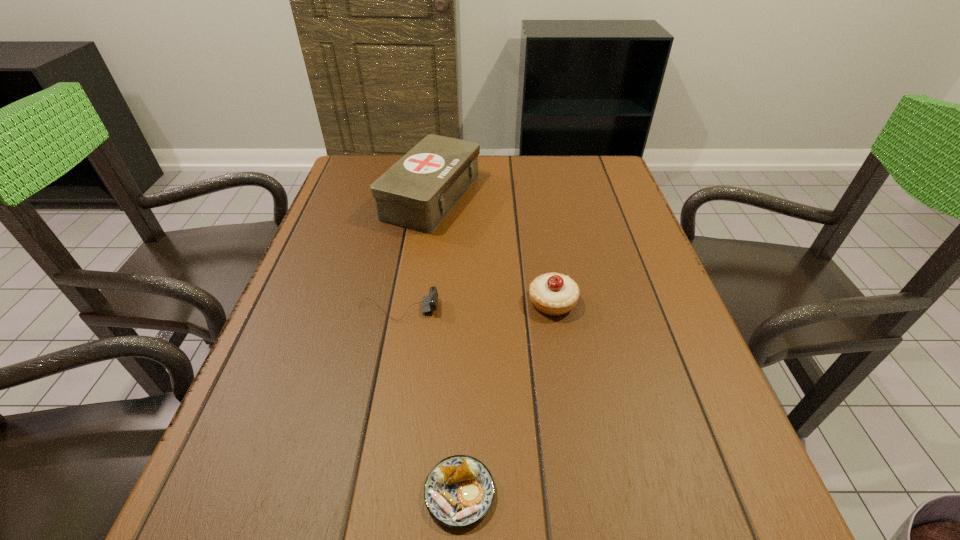
Find the location of a particular element. blank space located on the left of the nearer pastry is located at coordinates (307, 493).

Find the location of `object present at the far edge`. object present at the far edge is located at coordinates (419, 190).

Find the location of a particular element. The width and height of the screenshot is (960, 540). object located at the near edge is located at coordinates (459, 491).

The image size is (960, 540). Find the location of `the first-aid kit located at the left edge`. the first-aid kit located at the left edge is located at coordinates (419, 190).

This screenshot has width=960, height=540. Identify the location of webcam that is at the left edge. (429, 303).

Locate an element on the screen. The image size is (960, 540). object located in the far left corner section of the desktop is located at coordinates (419, 190).

At what (x,y) coordinates should I click in order to perform the action: click on vacant space at the far edge. Please return your answer as a coordinate pair (x, y). The width and height of the screenshot is (960, 540). Looking at the image, I should click on (547, 160).

At what (x,y) coordinates should I click in order to perform the action: click on free region at the left edge. Please return your answer as a coordinate pair (x, y). Looking at the image, I should click on (x=318, y=299).

Locate an element on the screen. vacant area at the right edge is located at coordinates (614, 264).

Where is `vacant area at the near left corner`? vacant area at the near left corner is located at coordinates (263, 510).